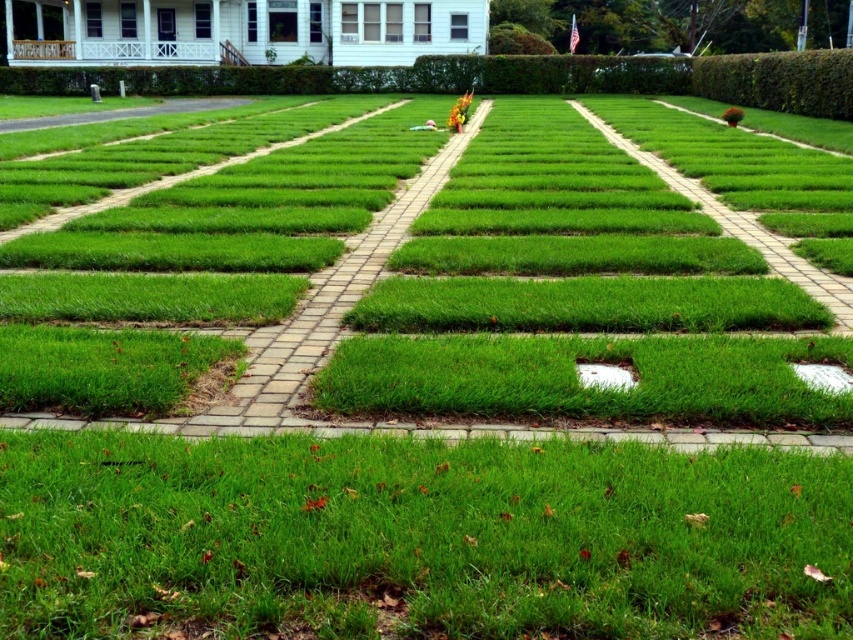
You are standing at the center of the lawn and want to walk towards the house. Which object, the green leafy hedge at upper right or the white painted wood porch at upper left, should you avoid walking through to stay on the central path?

You should avoid walking through the green leafy hedge at upper right because it is to the right of the white painted wood porch at upper left, which is closer to the central path leading to the house.

You are standing at the point marked as point (419,536) in the image. Based on the scene description, what is the object located at this coordinate?

The point (419,536) corresponds to green grass at lower center according to the description.

You are a gardener planning to water the green leafy hedge at upper right and the white matte patch at lower right. Which object is located above the other?

The green leafy hedge at upper right is positioned over the white matte patch at lower right, so the green leafy hedge at upper right is above the white matte patch at lower right.